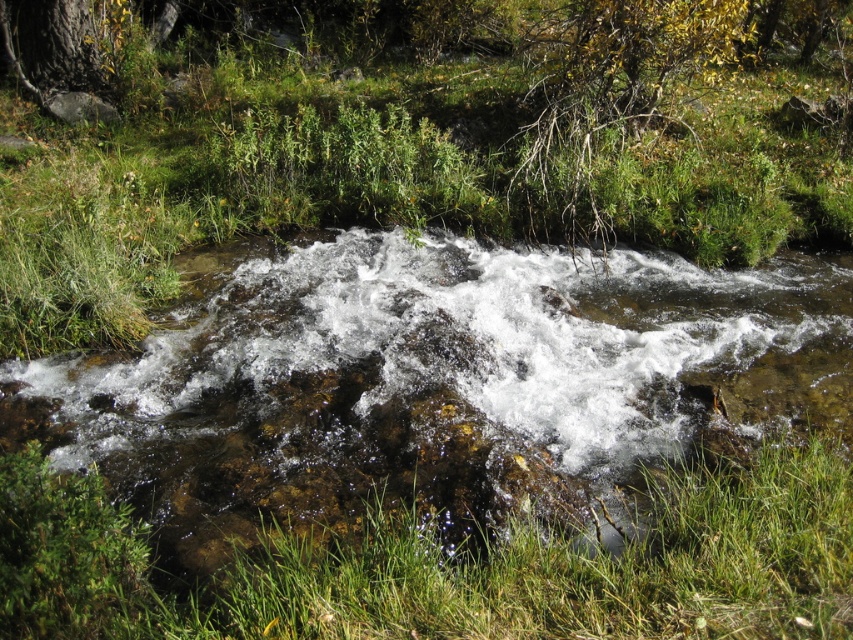
Find the location of a particular element. Image resolution: width=853 pixels, height=640 pixels. clear water at center is located at coordinates (x=442, y=385).

Who is lower down, clear water at center or green grass at center?

green grass at center

Locate an element on the screen. This screenshot has width=853, height=640. clear water at center is located at coordinates (442, 385).

Locate an element on the screen. The height and width of the screenshot is (640, 853). clear water at center is located at coordinates (442, 385).